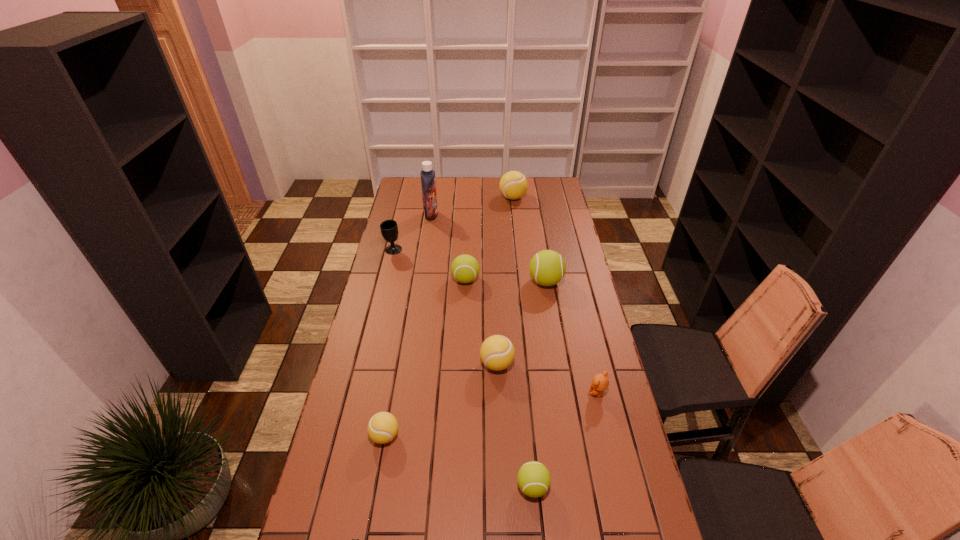
Identify the location of the tallest object. (428, 183).

Where is `blue shampoo`? blue shampoo is located at coordinates (428, 183).

The height and width of the screenshot is (540, 960). I want to click on the farthest tennis ball, so click(513, 185).

Where is `the farthest object`? Image resolution: width=960 pixels, height=540 pixels. the farthest object is located at coordinates (513, 185).

Locate an element on the screen. This screenshot has width=960, height=540. the rightmost green tennis ball is located at coordinates (547, 267).

Find the location of a particular element. This screenshot has height=540, width=960. the third farthest object is located at coordinates (389, 229).

The height and width of the screenshot is (540, 960). Identify the location of the third nearest tennis ball. (497, 352).

Locate an element on the screen. The width and height of the screenshot is (960, 540). the second smallest yellow tennis ball is located at coordinates [497, 352].

Identify the location of the sixth object from right to left. Image resolution: width=960 pixels, height=540 pixels. (464, 268).

The height and width of the screenshot is (540, 960). Identify the location of the second tennis ball from left to right. (464, 268).